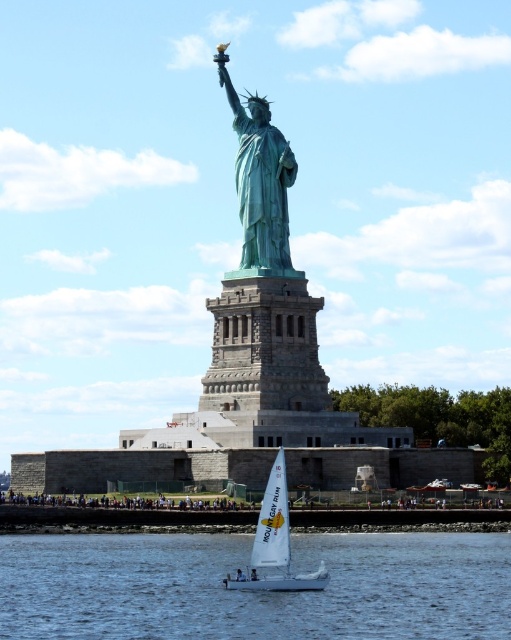
Question: Which point is closer to the camera?

Choices:
 (A) (257, 545)
 (B) (251, 237)

Answer: (A)

Question: Is green patina statue at center smaller than white sailboat at lower center?

Choices:
 (A) yes
 (B) no

Answer: (A)

Question: Is clear blue water at lower center thinner than white sailboat at lower center?

Choices:
 (A) yes
 (B) no

Answer: (B)

Question: Which point is farther to the camera?

Choices:
 (A) (117, 566)
 (B) (259, 188)
 (C) (268, 547)

Answer: (B)

Question: Can you confirm if green patina statue at center is thinner than white sailboat at lower center?

Choices:
 (A) no
 (B) yes

Answer: (A)

Question: Which point is farther to the camera?

Choices:
 (A) tap(253, 129)
 (B) tap(287, 620)

Answer: (A)